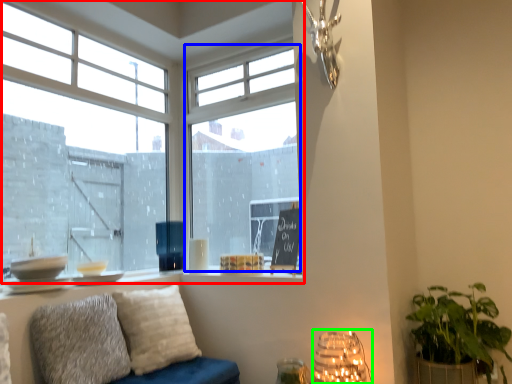
Question: Which is nearer to the window (highlighted by a red box)? window (highlighted by a blue box) or lamp (highlighted by a green box).

Choices:
 (A) window
 (B) lamp

Answer: (A)